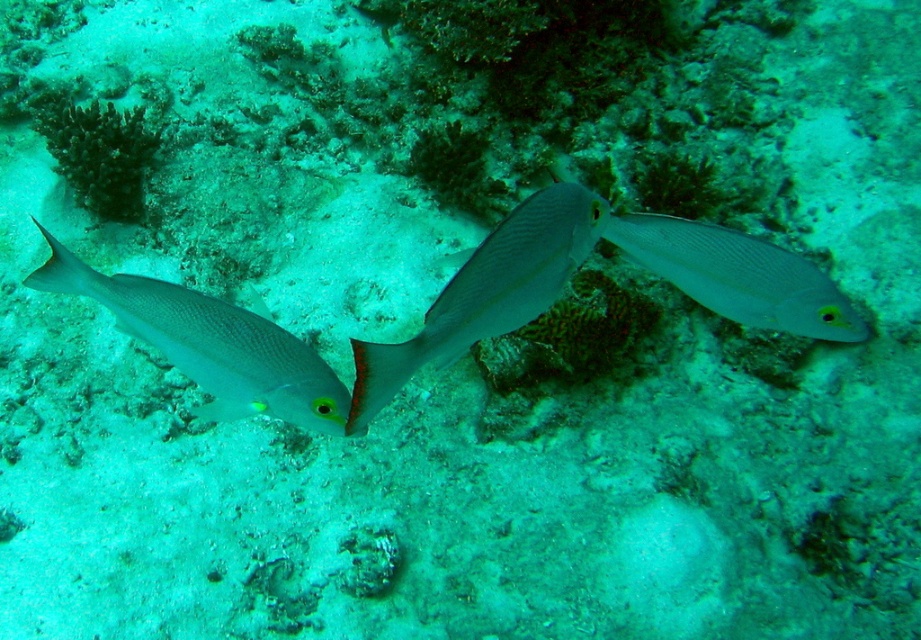
Question: Among these objects, which one is farthest from the camera?

Choices:
 (A) smooth silver fish at center
 (B) silvery smooth fish at left
 (C) satin silver fish at center

Answer: (C)

Question: Which point is farther to the camera?

Choices:
 (A) click(x=231, y=308)
 (B) click(x=455, y=336)

Answer: (A)

Question: Observing the image, what is the correct spatial positioning of silvery smooth fish at left in reference to smooth silver fish at center?

Choices:
 (A) above
 (B) below

Answer: (B)

Question: Considering the real-world distances, which object is farthest from the satin silver fish at center?

Choices:
 (A) smooth silver fish at center
 (B) silvery smooth fish at left

Answer: (B)

Question: Can you confirm if silvery smooth fish at left is positioned below smooth silver fish at center?

Choices:
 (A) yes
 (B) no

Answer: (A)

Question: Can you confirm if silvery smooth fish at left is positioned to the left of satin silver fish at center?

Choices:
 (A) yes
 (B) no

Answer: (A)